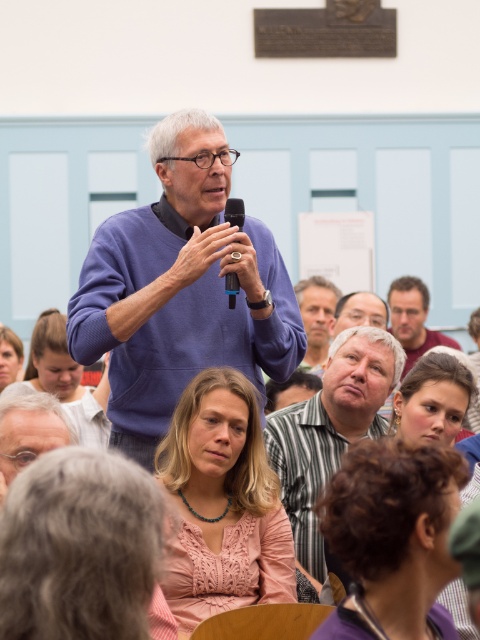
Question: Among these objects, which one is farthest from the camera?

Choices:
 (A) blonde hair at lower center
 (B) matte brown hair at lower right
 (C) blonde hair at center
 (D) matte gray shirt at center

Answer: (D)

Question: Is pink knitted sweater at center positioned behind blonde hair at lower center?

Choices:
 (A) no
 (B) yes

Answer: (B)

Question: Which of the following is the closest to the observer?

Choices:
 (A) (460, 378)
 (B) (428, 344)
 (C) (241, 224)
 (D) (191, 579)

Answer: (D)

Question: Is matte pink sweater at center bigger than matte gray shirt at center?

Choices:
 (A) yes
 (B) no

Answer: (A)

Question: Is matte blue sweater at center positioned behind light brown hair at center?

Choices:
 (A) no
 (B) yes

Answer: (A)

Question: Among these objects, which one is farthest from the camera?

Choices:
 (A) matte pink sweater at center
 (B) gray hair at lower left

Answer: (A)